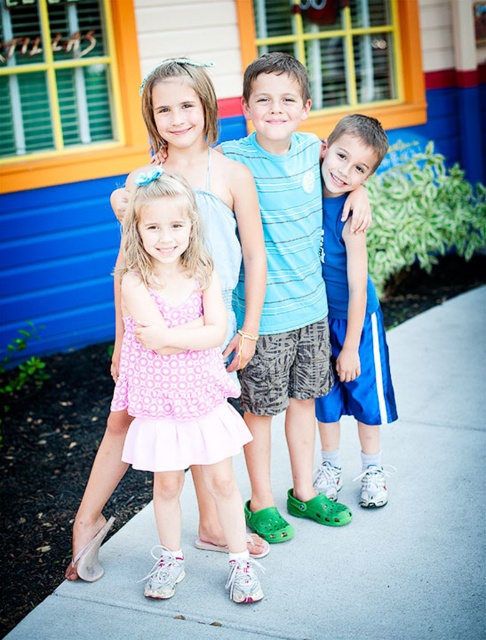
Question: Is pink satin dress at center in front of blue striped shirt at center?

Choices:
 (A) no
 (B) yes

Answer: (B)

Question: Is blue striped shirt at center bigger than blue athletic shorts at center?

Choices:
 (A) yes
 (B) no

Answer: (A)

Question: Which object is the closest to the gray concrete pavement at center?

Choices:
 (A) blue athletic shorts at center
 (B) blue striped shirt at center

Answer: (A)

Question: Does gray concrete pavement at center appear under blue striped shirt at center?

Choices:
 (A) no
 (B) yes

Answer: (B)

Question: Which of these objects is positioned farthest from the blue striped shirt at center?

Choices:
 (A) pink satin dress at center
 (B) gray concrete pavement at center
 (C) blue athletic shorts at center

Answer: (B)

Question: Which object appears closest to the camera in this image?

Choices:
 (A) blue striped shirt at center
 (B) gray concrete pavement at center
 (C) pink satin dress at center

Answer: (B)